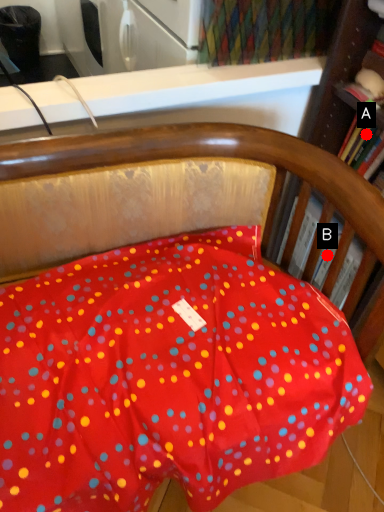
Question: Two points are circled on the image, labeled by A and B beside each circle. Which point appears closest to the camera in this image?

Choices:
 (A) A is closer
 (B) B is closer

Answer: (B)